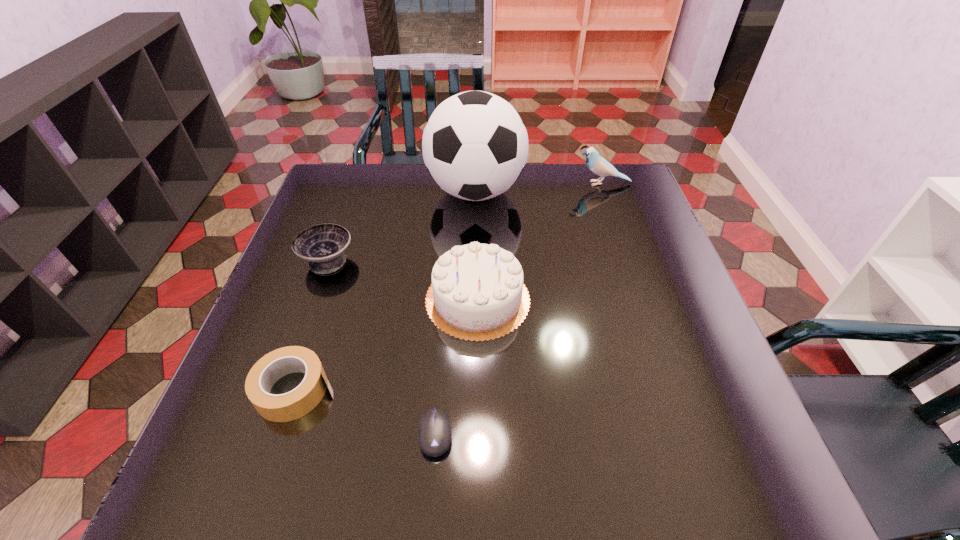
What are the coordinates of `soccer ball` in the screenshot? It's located at (475, 145).

Identify the location of birthday cake. This screenshot has width=960, height=540. (477, 293).

The height and width of the screenshot is (540, 960). Identify the location of bird. pyautogui.click(x=598, y=165).

Image resolution: width=960 pixels, height=540 pixels. I want to click on bowl, so click(323, 245).

Where is `duct tape`? duct tape is located at coordinates (298, 402).

Identify the location of computer mouse. (434, 433).

Locate an element on the screen. This screenshot has width=960, height=540. free location located 0.120m on the left of the tallest object is located at coordinates (387, 192).

You are a GUI agent. You are given a task and a screenshot of the screen. Output one action in this format:
    pyautogui.click(x=<x>, y=<y>)
    Task: Click on the free space located on the left of the birthday cake
    
    Given the screenshot: What is the action you would take?
    pyautogui.click(x=339, y=299)

Identify the location of free space located at the face of the rightmost object. This screenshot has height=540, width=960. (559, 184).

Find the location of a particular element. blank space located 0.280m at the face of the rightmost object is located at coordinates (485, 184).